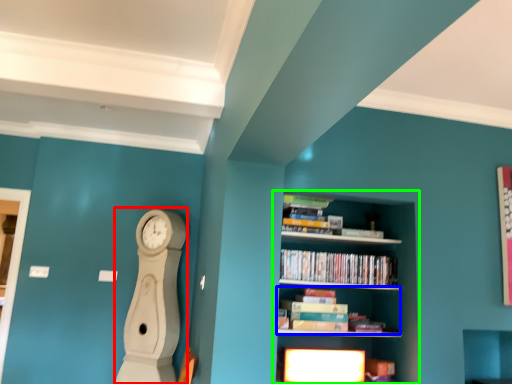
Question: Based on their relative distances, which object is nearer to clock (highlighted by a red box)? Choose from book (highlighted by a blue box) and shelf (highlighted by a green box).

Choices:
 (A) book
 (B) shelf

Answer: (A)